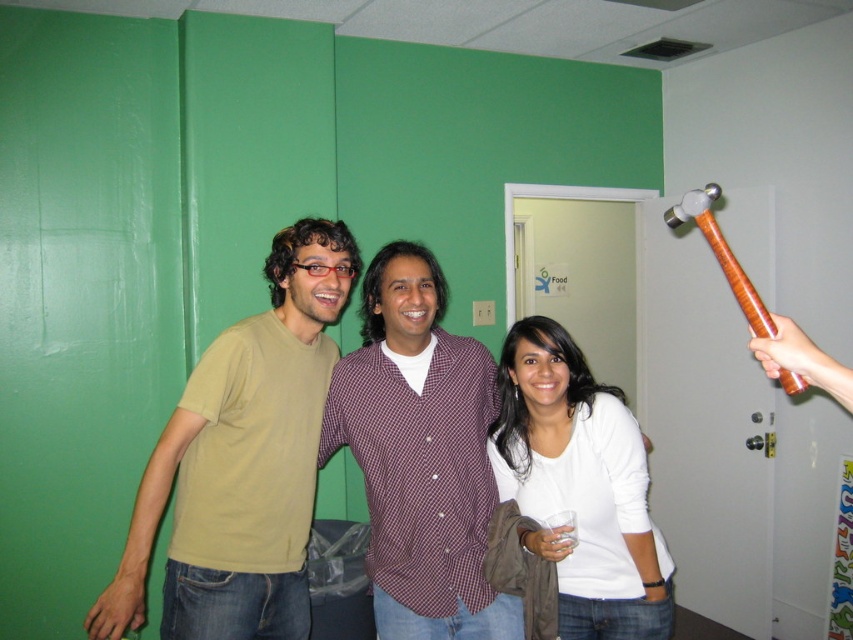
Question: Which point appears farthest from the camera in this image?

Choices:
 (A) (544, 545)
 (B) (418, 276)

Answer: (B)

Question: Among these points, which one is nearest to the camera?

Choices:
 (A) (543, 532)
 (B) (788, 365)

Answer: (B)

Question: Among these objects, which one is nearest to the camera?

Choices:
 (A) white matte shirt at center
 (B) translucent plastic cup at center
 (C) wooden hammer at upper right

Answer: (C)

Question: Is white matte shirt at center to the left of wooden hammer at upper right from the viewer's perspective?

Choices:
 (A) yes
 (B) no

Answer: (A)

Question: Can you confirm if matte yellow t-shirt at center is positioned above wooden hammer at upper right?

Choices:
 (A) no
 (B) yes

Answer: (A)

Question: Does matte yellow t-shirt at center appear over maroon checkered shirt at center?

Choices:
 (A) no
 (B) yes

Answer: (B)